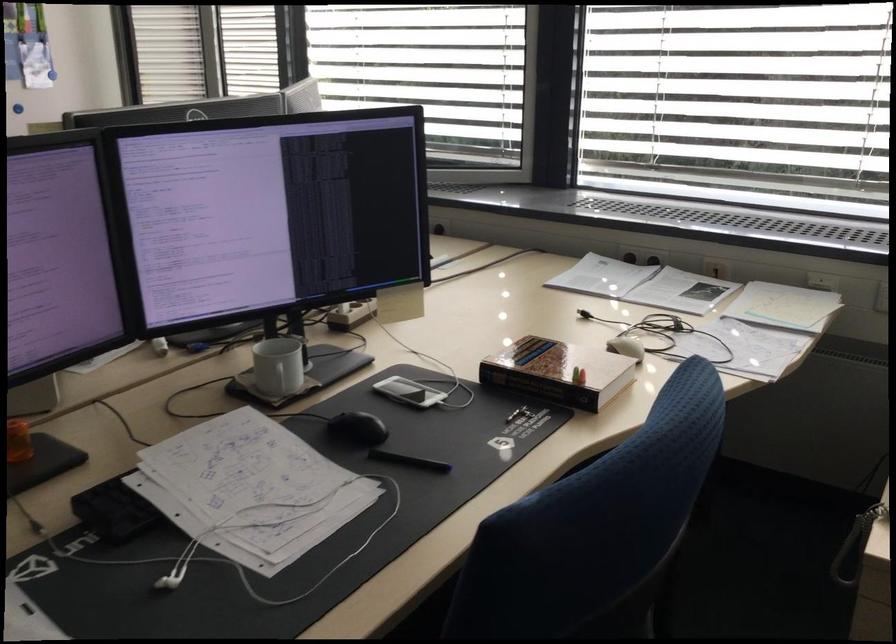
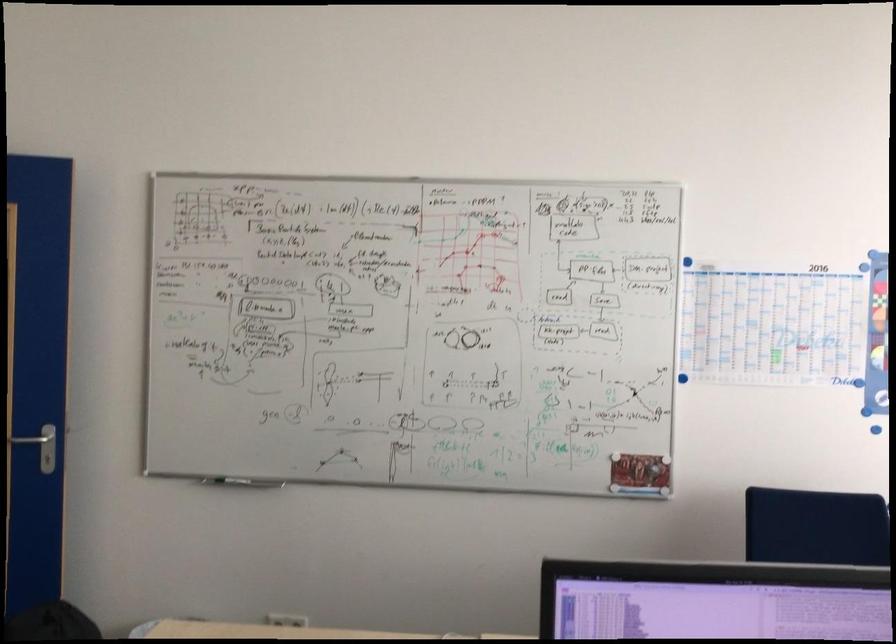
Question: Based on the continuous images, in which direction is the camera rotating? Reply with the corresponding letter.

Choices:
 (A) Left
 (B) Right
 (C) Up
 (D) Down

Answer: (A)